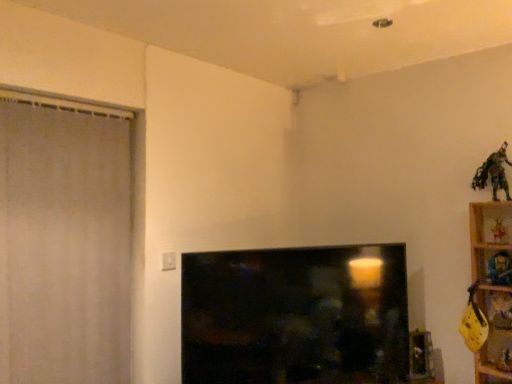
Question: From a real-world perspective, is wooden shelf at right physically below wooden toy at upper right, the 2th toy in the top-to-bottom sequence?

Choices:
 (A) yes
 (B) no

Answer: (A)

Question: Would you say wooden toy at upper right, the 2th toy in the top-to-bottom sequence, is part of wooden shelf at right's contents?

Choices:
 (A) yes
 (B) no

Answer: (A)

Question: Is wooden shelf at right placed right next to wooden toy at upper right, the 2th toy in the top-to-bottom sequence?

Choices:
 (A) yes
 (B) no

Answer: (B)

Question: Does wooden shelf at right have a lesser height compared to wooden toy at upper right, the 2th toy in the top-to-bottom sequence?

Choices:
 (A) yes
 (B) no

Answer: (B)

Question: Is wooden shelf at right positioned beyond the bounds of wooden toy at upper right, which is the fifth toy in bottom-to-top order?

Choices:
 (A) yes
 (B) no

Answer: (A)

Question: From a real-world perspective, is white fabric screen door at left physically located above or below yellow fabric toy at right, which is the 5th toy in top-to-bottom order?

Choices:
 (A) above
 (B) below

Answer: (A)

Question: Is point (1, 130) closer or farther from the camera than point (475, 331)?

Choices:
 (A) farther
 (B) closer

Answer: (B)

Question: In the image, is white fabric screen door at left on the left side or the right side of yellow fabric toy at right, which is the 5th toy in top-to-bottom order?

Choices:
 (A) left
 (B) right

Answer: (A)

Question: From the image's perspective, is white fabric screen door at left positioned above or below yellow fabric toy at right, which is counted as the second toy, starting from the bottom?

Choices:
 (A) below
 (B) above

Answer: (B)

Question: Visually, is black glossy tv at center positioned to the left or to the right of yellow fabric toy at lower right, the first toy from the bottom?

Choices:
 (A) left
 (B) right

Answer: (A)

Question: Is black glossy tv at center taller or shorter than yellow fabric toy at lower right, placed as the sixth toy when sorted from top to bottom?

Choices:
 (A) tall
 (B) short

Answer: (A)

Question: Would you say black glossy tv at center is inside or outside yellow fabric toy at lower right, the first toy from the bottom?

Choices:
 (A) inside
 (B) outside

Answer: (B)

Question: From the image's perspective, is black glossy tv at center located above or below yellow fabric toy at lower right, the first toy from the bottom?

Choices:
 (A) below
 (B) above

Answer: (B)

Question: Visually, is wooden shelf at right positioned to the left or to the right of metallic gold figurine at upper right, which is the 4th toy from bottom to top?

Choices:
 (A) left
 (B) right

Answer: (A)

Question: From the image's perspective, is wooden shelf at right positioned above or below metallic gold figurine at upper right, which is the 4th toy from bottom to top?

Choices:
 (A) above
 (B) below

Answer: (B)